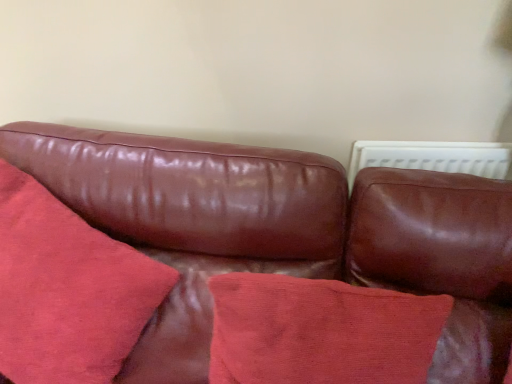
Question: Which direction should I rotate to face suede-like red pillow at center, which is the 1th throw pillow from left to right, — up or down?

Choices:
 (A) down
 (B) up

Answer: (A)

Question: From the image's perspective, is suede-like red pillow at center, which is the 2th throw pillow in right-to-left order, under cotton cushion at center, which is the second throw pillow from left to right?

Choices:
 (A) yes
 (B) no

Answer: (B)

Question: Can you confirm if suede-like red pillow at center, which is the 1th throw pillow from left to right, is smaller than cotton cushion at center, the 1th throw pillow in the right-to-left sequence?

Choices:
 (A) yes
 (B) no

Answer: (B)

Question: Is suede-like red pillow at center, which is the 2th throw pillow in right-to-left order, positioned with its back to cotton cushion at center, the 1th throw pillow in the right-to-left sequence?

Choices:
 (A) yes
 (B) no

Answer: (B)

Question: From a real-world perspective, is suede-like red pillow at center, which is the 1th throw pillow from left to right, located higher than cotton cushion at center, which is the second throw pillow from left to right?

Choices:
 (A) no
 (B) yes

Answer: (A)

Question: Does suede-like red pillow at center, which is the 1th throw pillow from left to right, turn towards cotton cushion at center, which is the second throw pillow from left to right?

Choices:
 (A) no
 (B) yes

Answer: (A)

Question: Can you confirm if suede-like red pillow at center, which is the 1th throw pillow from left to right, is positioned to the left of cotton cushion at center, the 1th throw pillow in the right-to-left sequence?

Choices:
 (A) no
 (B) yes

Answer: (B)

Question: Is suede-like red pillow at center, which is the 2th throw pillow in right-to-left order, shorter than leather couch at center?

Choices:
 (A) yes
 (B) no

Answer: (A)

Question: Can you confirm if suede-like red pillow at center, which is the 2th throw pillow in right-to-left order, is smaller than leather couch at center?

Choices:
 (A) no
 (B) yes

Answer: (B)

Question: From a real-world perspective, is suede-like red pillow at center, which is the 1th throw pillow from left to right, on leather couch at center?

Choices:
 (A) yes
 (B) no

Answer: (A)

Question: Is suede-like red pillow at center, which is the 1th throw pillow from left to right, bigger than leather couch at center?

Choices:
 (A) no
 (B) yes

Answer: (A)

Question: Can you confirm if suede-like red pillow at center, which is the 1th throw pillow from left to right, is wider than leather couch at center?

Choices:
 (A) no
 (B) yes

Answer: (A)

Question: Are suede-like red pillow at center, which is the 1th throw pillow from left to right, and leather couch at center located far from each other?

Choices:
 (A) yes
 (B) no

Answer: (B)

Question: Is leather couch at center oriented towards cotton cushion at center, the 1th throw pillow in the right-to-left sequence?

Choices:
 (A) yes
 (B) no

Answer: (A)